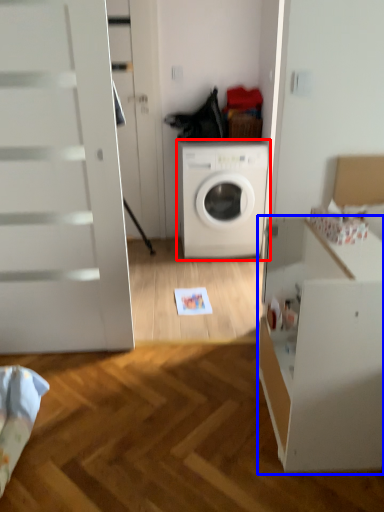
Question: Among these objects, which one is farthest to the camera, washing machine (highlighted by a red box) or file cabinet (highlighted by a blue box)?

Choices:
 (A) washing machine
 (B) file cabinet

Answer: (A)